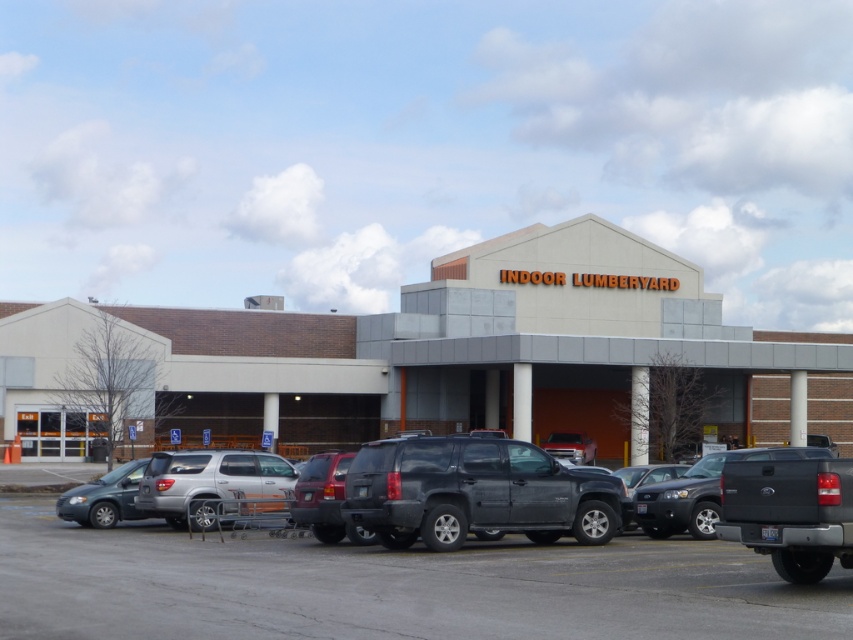
You are standing at the entrance of the INDOOR LUMBERYARD and want to reach a delivery truck parked at point (129, 481). There is an obstacle at point (4, 314). Can you go around the obstacle to reach the delivery truck?

Point (4, 314) is behind point (129, 481), so you can go around the obstacle at point (4, 314) to reach the delivery truck at point (129, 481).